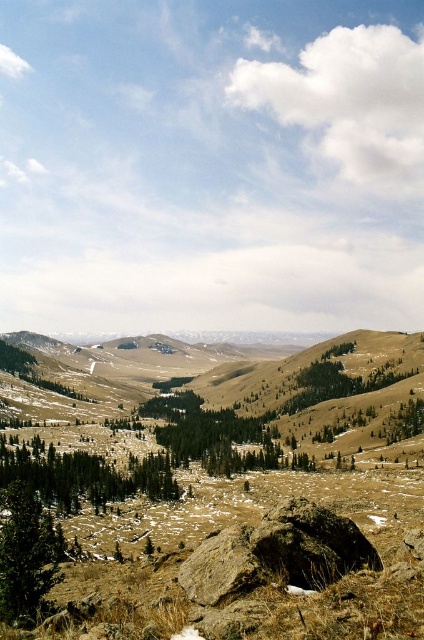
You are hiking and want to take a photo of the brown rough rock at center and the green matte tree at lower left. Which object should you stand closer to if you want both to be in the frame without moving the camera?

You should stand closer to the green matte tree at lower left because the brown rough rock at center is positioned on the right side of it, so moving closer to the tree will help keep both in the frame without shifting the camera.